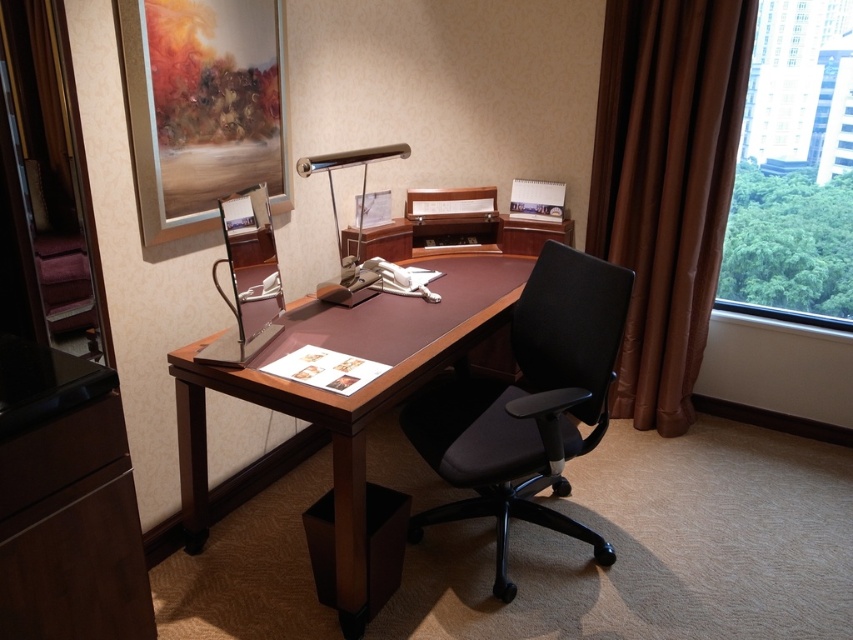
Can you confirm if brown velvet curtain at right is thinner than black fabric swivel chair at center?

Yes, brown velvet curtain at right is thinner than black fabric swivel chair at center.

Between point (683, 387) and point (537, 289), which one is positioned in front?

Positioned in front is point (537, 289).

Find the location of `brown velvet curtain at right`. brown velvet curtain at right is located at coordinates (666, 184).

Can you confirm if brown velvet curtain at right is positioned to the left of brown matte drawer at lower left?

Incorrect, brown velvet curtain at right is not on the left side of brown matte drawer at lower left.

Identify the location of brown velvet curtain at right. The width and height of the screenshot is (853, 640). (666, 184).

Is transparent glass window at right taller than satin silver desk lamp at center?

Yes.

Is transparent glass window at right further to camera compared to satin silver desk lamp at center?

Yes.

Where is `transparent glass window at right`? The image size is (853, 640). transparent glass window at right is located at coordinates (793, 164).

Where is `transparent glass window at right`? The height and width of the screenshot is (640, 853). transparent glass window at right is located at coordinates (793, 164).